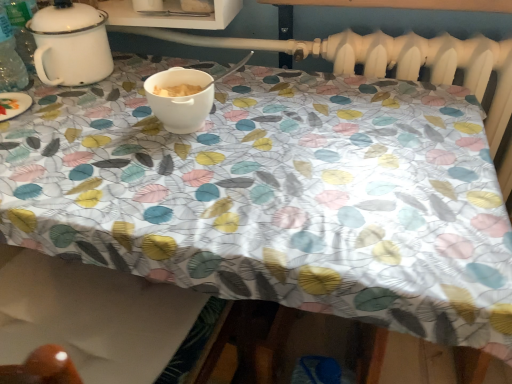
Question: Should I look upward or downward to see white matte bowl at center?

Choices:
 (A) up
 (B) down

Answer: (A)

Question: Is white enamel pot at upper left oriented towards white matte bowl at center?

Choices:
 (A) yes
 (B) no

Answer: (B)

Question: Is white enamel pot at upper left with white matte bowl at center?

Choices:
 (A) no
 (B) yes

Answer: (A)

Question: From a real-world perspective, is white enamel pot at upper left below white matte bowl at center?

Choices:
 (A) no
 (B) yes

Answer: (A)

Question: Can you confirm if white enamel pot at upper left is taller than white matte bowl at center?

Choices:
 (A) yes
 (B) no

Answer: (A)

Question: From the image's perspective, would you say white enamel pot at upper left is positioned over white matte bowl at center?

Choices:
 (A) yes
 (B) no

Answer: (A)

Question: Can you confirm if white enamel pot at upper left is bigger than white matte bowl at center?

Choices:
 (A) no
 (B) yes

Answer: (B)

Question: Is white matte bowl at center directly adjacent to white enamel pot at upper left?

Choices:
 (A) no
 (B) yes

Answer: (A)

Question: Is white enamel pot at upper left a part of white matte bowl at center?

Choices:
 (A) yes
 (B) no

Answer: (B)

Question: Does white matte bowl at center turn towards white enamel pot at upper left?

Choices:
 (A) yes
 (B) no

Answer: (B)

Question: Is white matte bowl at center at the left side of white enamel pot at upper left?

Choices:
 (A) yes
 (B) no

Answer: (B)

Question: From the image's perspective, is white matte bowl at center over white enamel pot at upper left?

Choices:
 (A) no
 (B) yes

Answer: (A)

Question: Is the position of white matte bowl at center more distant than that of white enamel pot at upper left?

Choices:
 (A) no
 (B) yes

Answer: (A)

Question: Which is correct: white enamel pot at upper left is inside white matte bowl at center, or outside of it?

Choices:
 (A) outside
 (B) inside

Answer: (A)